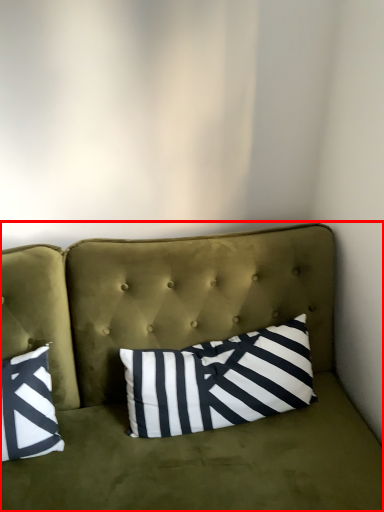
Question: From the image's perspective, where is studio couch (annotated by the red box) located in relation to pillow in the image?

Choices:
 (A) above
 (B) below

Answer: (B)